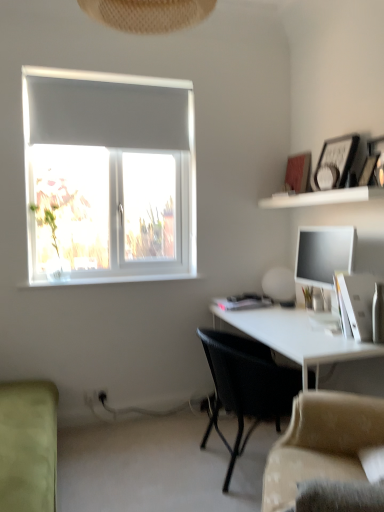
Question: Is black woven chair at center positioned far away from light green fabric couch at lower left, which is the first studio couch from left to right?

Choices:
 (A) yes
 (B) no

Answer: (B)

Question: From the image's perspective, is black woven chair at center below light green fabric couch at lower left, which is the 2th studio couch in right-to-left order?

Choices:
 (A) yes
 (B) no

Answer: (B)

Question: Can you confirm if black woven chair at center is smaller than light green fabric couch at lower left, which is the 2th studio couch in right-to-left order?

Choices:
 (A) no
 (B) yes

Answer: (B)

Question: Is black woven chair at center facing away from light green fabric couch at lower left, which is the 2th studio couch in right-to-left order?

Choices:
 (A) yes
 (B) no

Answer: (A)

Question: Does black woven chair at center have a greater width compared to light green fabric couch at lower left, which is the first studio couch from left to right?

Choices:
 (A) yes
 (B) no

Answer: (A)

Question: Would you say satin black monitor at right is to the left or to the right of white glossy shelf at upper right in the picture?

Choices:
 (A) right
 (B) left

Answer: (A)

Question: Is satin black monitor at right taller or shorter than white glossy shelf at upper right?

Choices:
 (A) short
 (B) tall

Answer: (B)

Question: Is point (324, 245) positioned closer to the camera than point (304, 193)?

Choices:
 (A) farther
 (B) closer

Answer: (B)

Question: In the image, is satin black monitor at right positioned in front of or behind white glossy shelf at upper right?

Choices:
 (A) behind
 (B) front

Answer: (A)

Question: From a real-world perspective, is white glossy desk at lower right physically located above or below beige fabric couch at lower right, which ranks as the 2th studio couch in left-to-right order?

Choices:
 (A) below
 (B) above

Answer: (A)

Question: Is white glossy desk at lower right wider or thinner than beige fabric couch at lower right, which ranks as the 2th studio couch in left-to-right order?

Choices:
 (A) wide
 (B) thin

Answer: (A)

Question: Is white glossy desk at lower right in front of or behind beige fabric couch at lower right, which ranks as the 2th studio couch in left-to-right order, in the image?

Choices:
 (A) behind
 (B) front

Answer: (A)

Question: Considering the positions of white glossy desk at lower right and beige fabric couch at lower right, which ranks as the 2th studio couch in left-to-right order, in the image, is white glossy desk at lower right bigger or smaller than beige fabric couch at lower right, which ranks as the 2th studio couch in left-to-right order,?

Choices:
 (A) big
 (B) small

Answer: (A)

Question: In the image, is beige fabric couch at lower right, which ranks as the 2th studio couch in left-to-right order, positioned in front of or behind white glossy desk at lower right?

Choices:
 (A) behind
 (B) front

Answer: (B)

Question: From a real-world perspective, is beige fabric couch at lower right, arranged as the first studio couch when viewed from the right, physically located above or below white glossy desk at lower right?

Choices:
 (A) below
 (B) above

Answer: (B)